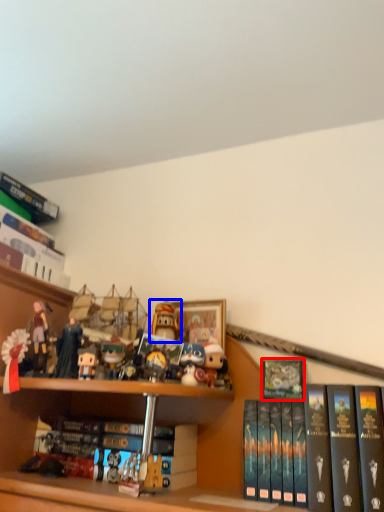
Question: Which point is closer to the camera, book (highlighted by a red box) or toy (highlighted by a blue box)?

Choices:
 (A) book
 (B) toy

Answer: (A)